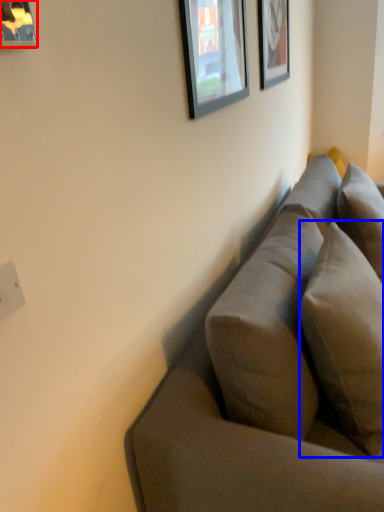
Question: Among these objects, which one is nearest to the camera, picture frame (highlighted by a red box) or pillow (highlighted by a blue box)?

Choices:
 (A) picture frame
 (B) pillow

Answer: (A)